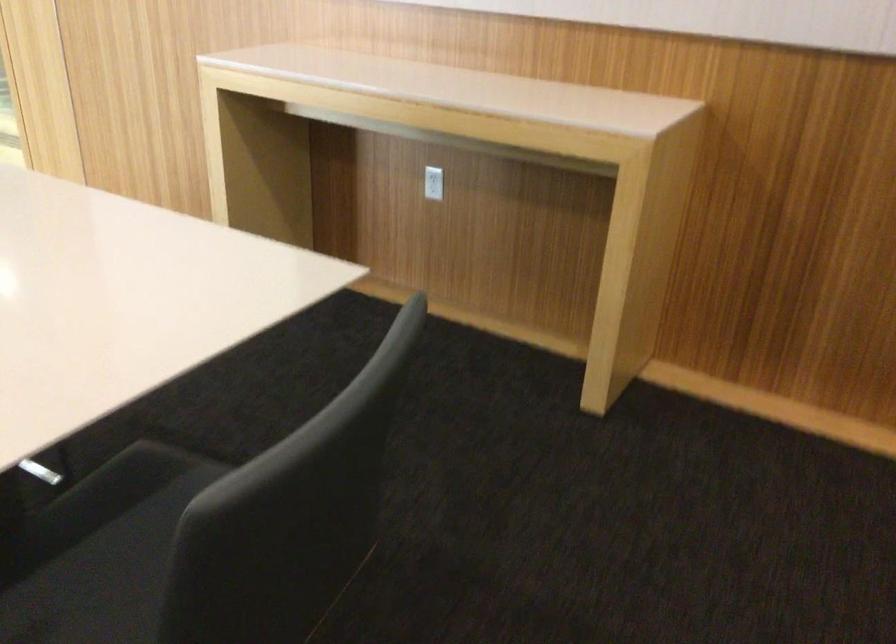
This screenshot has height=644, width=896. What do you see at coordinates (433, 183) in the screenshot? I see `the white power outlet` at bounding box center [433, 183].